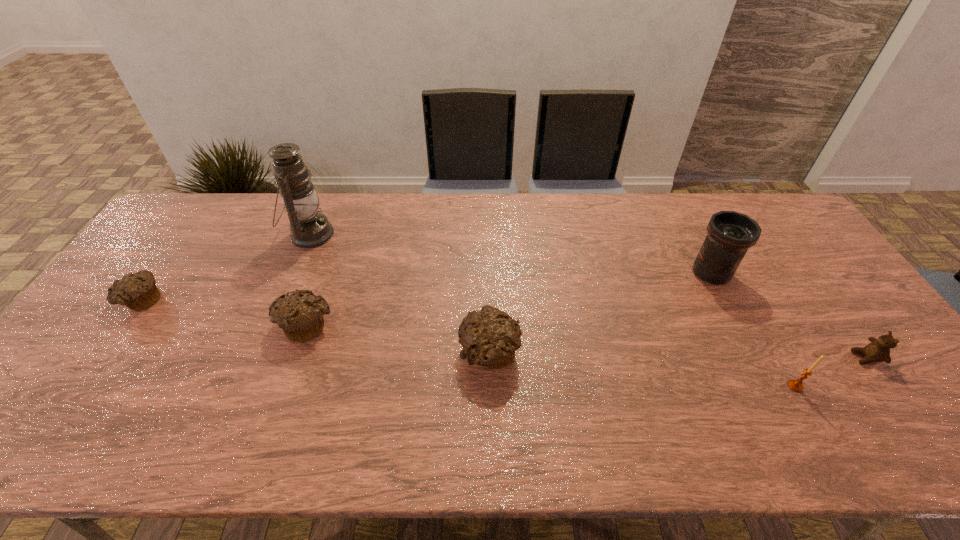
This screenshot has height=540, width=960. Find the location of `the leftmost object`. the leftmost object is located at coordinates (138, 291).

Image resolution: width=960 pixels, height=540 pixels. I want to click on the leftmost muffin, so click(x=138, y=291).

The image size is (960, 540). I want to click on the second muffin from right to left, so click(300, 315).

Locate an element on the screen. The width and height of the screenshot is (960, 540). the rightmost muffin is located at coordinates (490, 337).

I want to click on the farthest object, so click(x=309, y=228).

Where is `oil lamp`? oil lamp is located at coordinates (309, 228).

Find the location of a particular element. The width and height of the screenshot is (960, 540). teddy bear is located at coordinates (878, 350).

This screenshot has height=540, width=960. In order to click on telephoto lens in this screenshot , I will do `click(730, 234)`.

In order to click on candle_holder in this screenshot , I will do `click(796, 385)`.

Image resolution: width=960 pixels, height=540 pixels. In order to click on blank area located 0.250m on the front of the leftmost object in this screenshot , I will do (x=71, y=401).